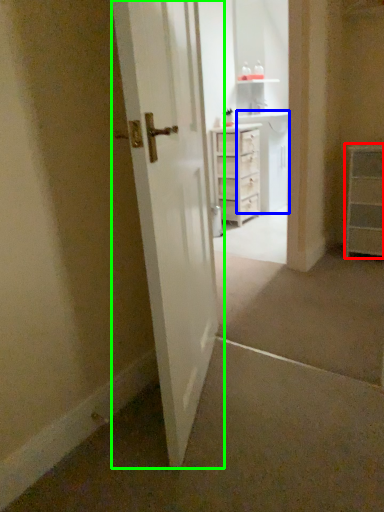
Question: Which object is positioned farthest from chest of drawers (highlighted by a red box)? Select from cabinetry (highlighted by a blue box) and door (highlighted by a green box).

Choices:
 (A) cabinetry
 (B) door

Answer: (B)